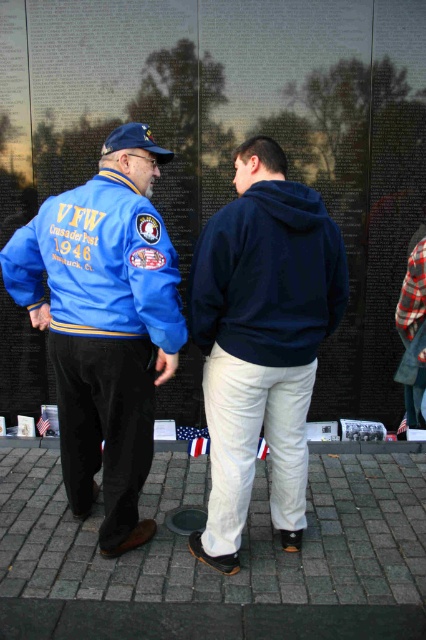
Can you confirm if blue leather jacket at left is positioned to the right of american flag at center?

Indeed, blue leather jacket at left is positioned on the right side of american flag at center.

Who is lower down, blue leather jacket at left or american flag at center?

american flag at center is below.

Is point (126, 285) positioned before point (48, 428)?

Yes, point (126, 285) is closer to viewer.

In order to click on blue leather jacket at left in this screenshot , I will do `click(103, 330)`.

Between navy fleece hoodie at center and blue fabric baseball cap at left, which one has more height?

Standing taller between the two is navy fleece hoodie at center.

How much distance is there between navy fleece hoodie at center and blue fabric baseball cap at left?

The distance of navy fleece hoodie at center from blue fabric baseball cap at left is 78.44 centimeters.

Is point (267, 355) farther from viewer compared to point (129, 145)?

No.

What are the coordinates of `navy fleece hoodie at center` in the screenshot? It's located at (267, 276).

Can you confirm if blue leather jacket at left is smaller than blue fabric baseball cap at left?

Actually, blue leather jacket at left might be larger than blue fabric baseball cap at left.

Which is in front, point (129, 419) or point (152, 141)?

Positioned in front is point (129, 419).

You are a GUI agent. You are given a task and a screenshot of the screen. Output one action in this format:
    pyautogui.click(x=<x>, y=<y>)
    Task: Click on the blue leather jacket at left
    The height and width of the screenshot is (640, 426).
    Given the screenshot: What is the action you would take?
    pyautogui.click(x=103, y=330)